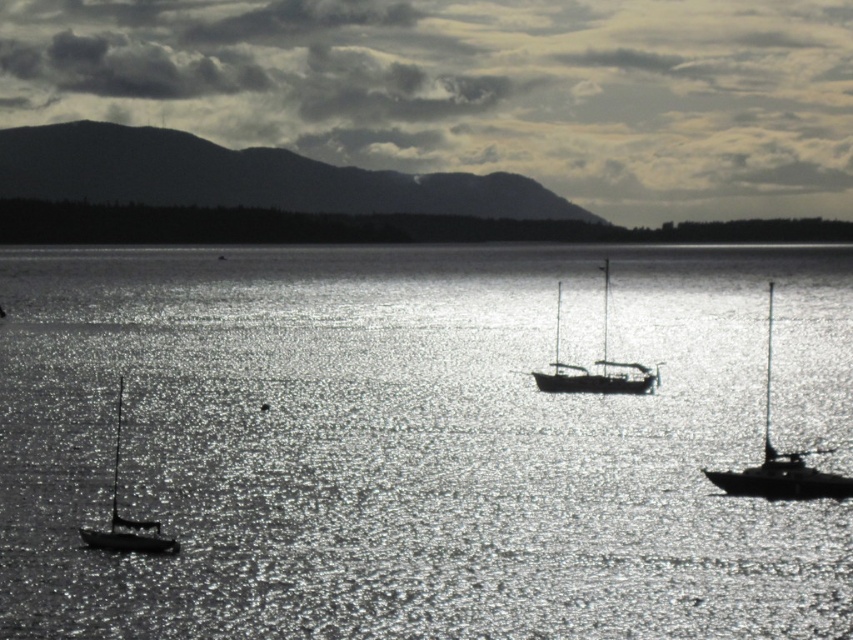
Is silvery metallic sailboat at right wider than silvery metallic sailboat at center?

In fact, silvery metallic sailboat at right might be narrower than silvery metallic sailboat at center.

Is point (767, 358) farther from viewer compared to point (631, 378)?

That is True.

Which is in front, point (769, 314) or point (560, 301)?

Positioned in front is point (769, 314).

Find the location of a particular element. The height and width of the screenshot is (640, 853). silvery metallic sailboat at right is located at coordinates (780, 461).

Can you confirm if sparkling silver water at center is wider than silvery metallic sailboat at right?

Yes.

Find the location of `sparkling silver water at center`. sparkling silver water at center is located at coordinates (419, 442).

Is point (354, 593) positioned in front of point (769, 388)?

That is True.

Find the location of a particular element. Image resolution: width=853 pixels, height=640 pixels. sparkling silver water at center is located at coordinates (419, 442).

Can you confirm if sparkling silver water at center is bigger than silvery metallic sailboat at lower left?

Correct, sparkling silver water at center is larger in size than silvery metallic sailboat at lower left.

Is the position of sparkling silver water at center less distant than that of silvery metallic sailboat at lower left?

Yes, sparkling silver water at center is closer to the viewer.

Locate an element on the screen. The width and height of the screenshot is (853, 640). sparkling silver water at center is located at coordinates (419, 442).